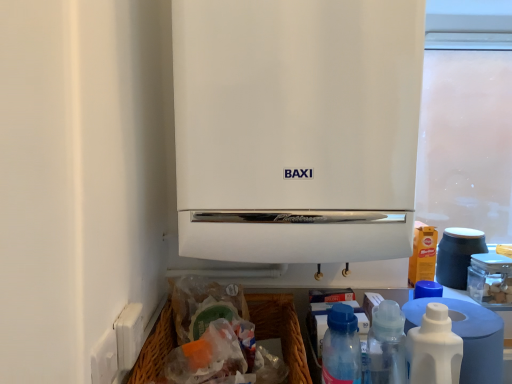
Question: Considering the relative sizes of matte blue cup at right and blue translucent bottle at lower right, which appears as the 2th bottle when viewed from the right, in the image provided, is matte blue cup at right bigger than blue translucent bottle at lower right, which appears as the 2th bottle when viewed from the right,?

Choices:
 (A) no
 (B) yes

Answer: (B)

Question: Is the depth of matte blue cup at right less than that of blue translucent bottle at lower right, arranged as the first bottle when viewed from the left?

Choices:
 (A) no
 (B) yes

Answer: (A)

Question: Is matte blue cup at right positioned with its back to blue translucent bottle at lower right, arranged as the first bottle when viewed from the left?

Choices:
 (A) yes
 (B) no

Answer: (B)

Question: Considering the relative positions of matte blue cup at right and blue translucent bottle at lower right, which appears as the 2th bottle when viewed from the right, in the image provided, is matte blue cup at right to the right of blue translucent bottle at lower right, which appears as the 2th bottle when viewed from the right, from the viewer's perspective?

Choices:
 (A) yes
 (B) no

Answer: (A)

Question: Is matte blue cup at right at the left side of blue translucent bottle at lower right, arranged as the first bottle when viewed from the left?

Choices:
 (A) yes
 (B) no

Answer: (B)

Question: Would you say blue translucent bottle at lower right, arranged as the first bottle when viewed from the left, is inside or outside matte blue cup at right?

Choices:
 (A) outside
 (B) inside

Answer: (A)

Question: From a real-world perspective, relative to matte blue cup at right, is blue translucent bottle at lower right, arranged as the first bottle when viewed from the left, vertically above or below?

Choices:
 (A) above
 (B) below

Answer: (B)

Question: Considering the positions of blue translucent bottle at lower right, arranged as the first bottle when viewed from the left, and matte blue cup at right in the image, is blue translucent bottle at lower right, arranged as the first bottle when viewed from the left, taller or shorter than matte blue cup at right?

Choices:
 (A) short
 (B) tall

Answer: (B)

Question: Based on their positions, is blue translucent bottle at lower right, arranged as the first bottle when viewed from the left, located to the left or right of matte blue cup at right?

Choices:
 (A) right
 (B) left

Answer: (B)

Question: In terms of width, does woven brown basket at lower center look wider or thinner when compared to white plastic bottle at lower right, the first bottle from the right?

Choices:
 (A) wide
 (B) thin

Answer: (A)

Question: Which is correct: woven brown basket at lower center is inside white plastic bottle at lower right, which appears as the second bottle when viewed from the left, or outside of it?

Choices:
 (A) outside
 (B) inside

Answer: (A)

Question: In terms of height, does woven brown basket at lower center look taller or shorter compared to white plastic bottle at lower right, the first bottle from the right?

Choices:
 (A) short
 (B) tall

Answer: (A)

Question: In terms of size, does woven brown basket at lower center appear bigger or smaller than white plastic bottle at lower right, which appears as the second bottle when viewed from the left?

Choices:
 (A) small
 (B) big

Answer: (B)

Question: Does point (316, 46) appear closer or farther from the camera than point (325, 339)?

Choices:
 (A) closer
 (B) farther

Answer: (A)

Question: From the image's perspective, relative to blue translucent bottle at lower right, arranged as the first bottle when viewed from the left, is white matte boiler at center above or below?

Choices:
 (A) below
 (B) above

Answer: (B)